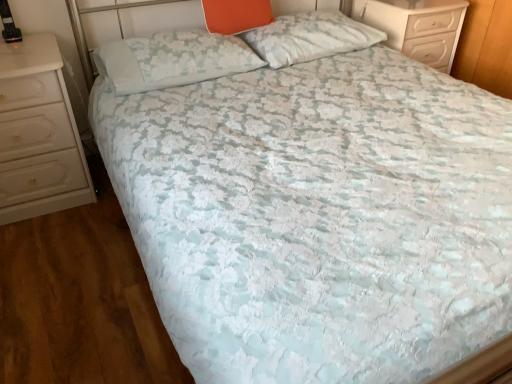
Question: Is white glossy chest of drawers at left, placed as the first chest of drawers when sorted from bottom to top, completely or partially outside of orange fabric pillow at upper center, which is the 2th pillow in right-to-left order?

Choices:
 (A) yes
 (B) no

Answer: (A)

Question: Can you confirm if white glossy chest of drawers at left, positioned as the 2th chest of drawers in back-to-front order, is thinner than orange fabric pillow at upper center, arranged as the 2th pillow when viewed from the left?

Choices:
 (A) no
 (B) yes

Answer: (A)

Question: Is white glossy chest of drawers at left, positioned as the 2th chest of drawers in back-to-front order, directly adjacent to orange fabric pillow at upper center, which is the 2th pillow in right-to-left order?

Choices:
 (A) no
 (B) yes

Answer: (A)

Question: From the image's perspective, is white glossy chest of drawers at left, positioned as the 2th chest of drawers in back-to-front order, below orange fabric pillow at upper center, which is the 2th pillow in right-to-left order?

Choices:
 (A) yes
 (B) no

Answer: (A)

Question: Is white glossy chest of drawers at left, placed as the first chest of drawers when sorted from bottom to top, facing towards orange fabric pillow at upper center, which is the 2th pillow in right-to-left order?

Choices:
 (A) no
 (B) yes

Answer: (A)

Question: Is white glossy chest of drawers at upper right, arranged as the first chest of drawers when viewed from the right, to the left or to the right of orange fabric pillow at upper center, arranged as the 2th pillow when viewed from the left, in the image?

Choices:
 (A) left
 (B) right

Answer: (B)

Question: Considering the positions of white glossy chest of drawers at upper right, placed as the 1th chest of drawers when sorted from back to front, and orange fabric pillow at upper center, which is the 2th pillow in right-to-left order, in the image, is white glossy chest of drawers at upper right, placed as the 1th chest of drawers when sorted from back to front, wider or thinner than orange fabric pillow at upper center, which is the 2th pillow in right-to-left order,?

Choices:
 (A) wide
 (B) thin

Answer: (A)

Question: Is point (456, 31) positioned closer to the camera than point (221, 1)?

Choices:
 (A) closer
 (B) farther

Answer: (B)

Question: In terms of height, does white glossy chest of drawers at upper right, arranged as the first chest of drawers when viewed from the right, look taller or shorter compared to orange fabric pillow at upper center, arranged as the 2th pillow when viewed from the left?

Choices:
 (A) tall
 (B) short

Answer: (A)

Question: Looking at their shapes, would you say white textured pillow at upper center, which is counted as the 3th pillow, starting from the right, is wider or thinner than white textured pillow at upper center, the 3th pillow viewed from the left?

Choices:
 (A) thin
 (B) wide

Answer: (A)

Question: Is point (134, 38) positioned closer to the camera than point (295, 13)?

Choices:
 (A) closer
 (B) farther

Answer: (A)

Question: In the image, is white textured pillow at upper center, which is the 1th pillow in left-to-right order, positioned in front of or behind white textured pillow at upper center, the 3th pillow viewed from the left?

Choices:
 (A) behind
 (B) front

Answer: (B)

Question: Visually, is white textured pillow at upper center, which is the 1th pillow in left-to-right order, positioned to the left or to the right of white textured pillow at upper center, the 3th pillow viewed from the left?

Choices:
 (A) left
 (B) right

Answer: (A)

Question: Relative to orange fabric pillow at upper center, arranged as the 2th pillow when viewed from the left, is white textured pillow at upper center, which is the 1th pillow in left-to-right order, in front or behind?

Choices:
 (A) front
 (B) behind

Answer: (A)

Question: From a real-world perspective, is white textured pillow at upper center, which is the 1th pillow in left-to-right order, physically located above or below orange fabric pillow at upper center, which is the 2th pillow in right-to-left order?

Choices:
 (A) below
 (B) above

Answer: (A)